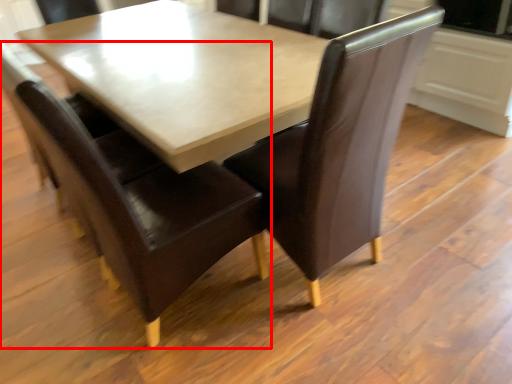
Question: In this image, where is chair (annotated by the red box) located relative to chair?

Choices:
 (A) left
 (B) right

Answer: (A)